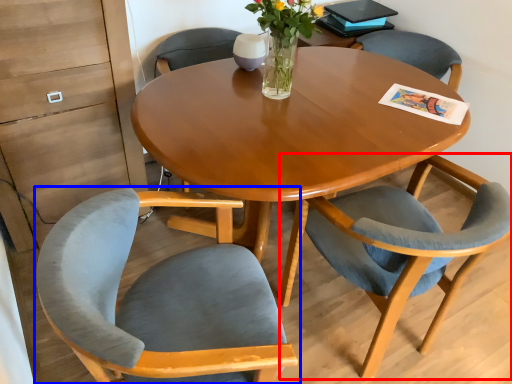
Question: Among these objects, which one is nearest to the camera, chair (highlighted by a red box) or chair (highlighted by a blue box)?

Choices:
 (A) chair
 (B) chair

Answer: (B)